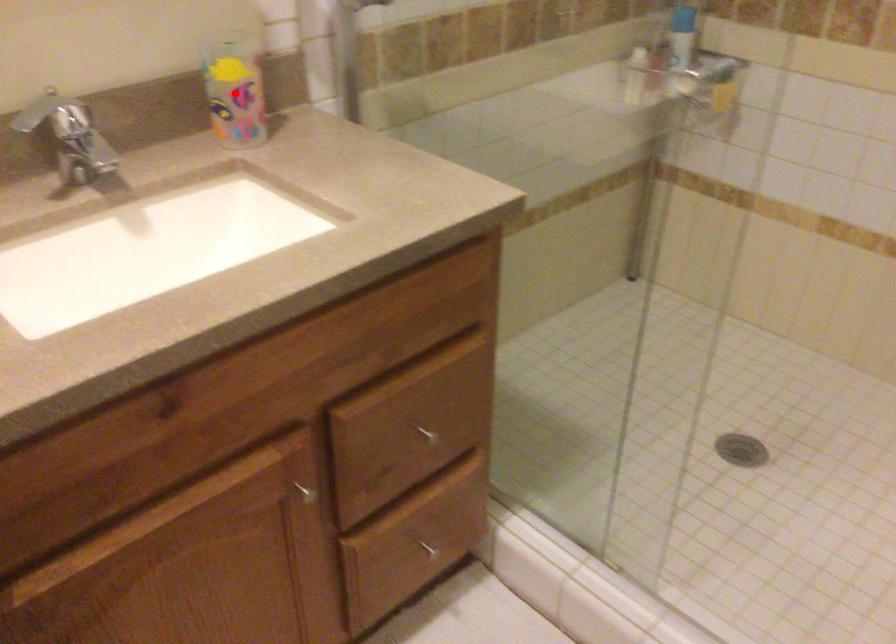
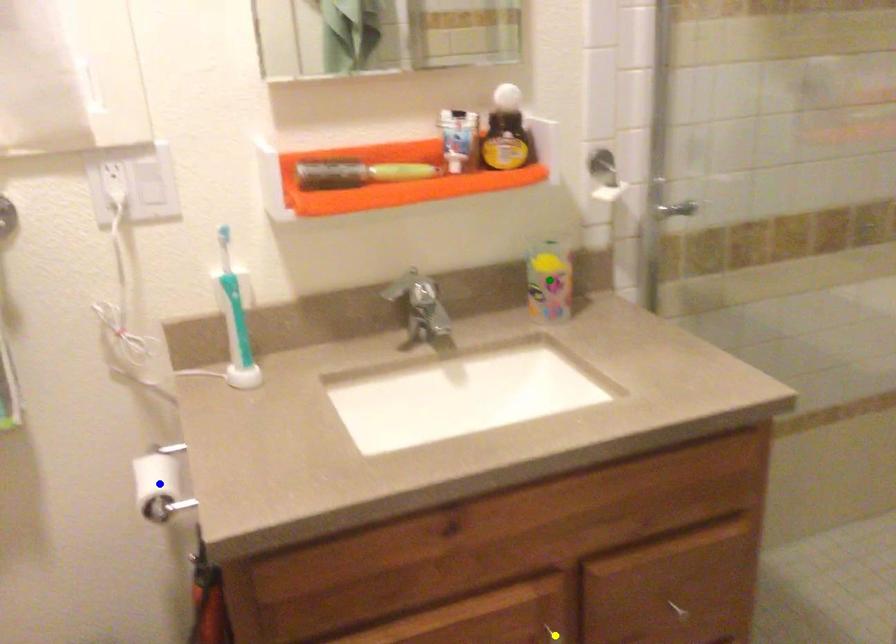
Question: I am providing you with two images of the same scene from different viewpoints. A red point is marked on the first image. You are given multiple points on the second image. Which mark in image 2 goes with the point in image 1?

Choices:
 (A) blue point
 (B) green point
 (C) yellow point

Answer: (B)